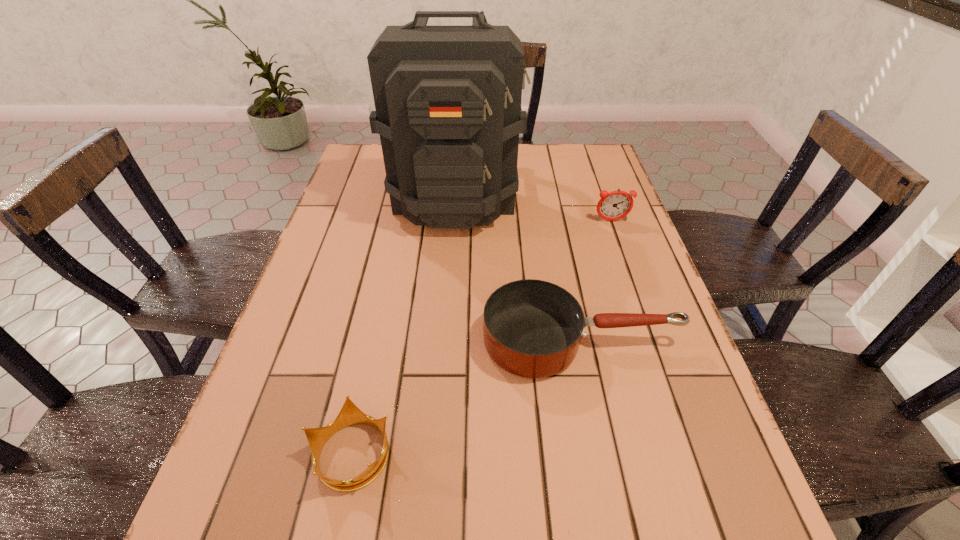
Where is `alarm clock at the right edge`? The width and height of the screenshot is (960, 540). alarm clock at the right edge is located at coordinates (615, 205).

Where is `pan that is at the right edge`? The image size is (960, 540). pan that is at the right edge is located at coordinates (532, 328).

This screenshot has height=540, width=960. In order to click on object positioned at the far left corner in this screenshot , I will do `click(448, 109)`.

Locate an element on the screen. vacant region at the far edge of the desktop is located at coordinates (557, 172).

This screenshot has width=960, height=540. In the image, there is a desktop. Find the location of `vacant space at the left edge`. vacant space at the left edge is located at coordinates pyautogui.click(x=293, y=373).

The image size is (960, 540). I want to click on free space at the right edge of the desktop, so click(617, 230).

You are a GUI agent. You are given a task and a screenshot of the screen. Output one action in this format:
    pyautogui.click(x=<x>, y=<y>)
    Task: Click on the free space at the far right corner
    The height and width of the screenshot is (540, 960).
    Given the screenshot: What is the action you would take?
    pyautogui.click(x=575, y=175)

Identify the location of free space at the near right corner. coord(663,530).

This screenshot has height=540, width=960. What are the coordinates of `free space between the crown and the alarm clock` in the screenshot? It's located at (482, 337).

Where is `free space between the tallest object and the crown`? The image size is (960, 540). free space between the tallest object and the crown is located at coordinates (x=403, y=325).